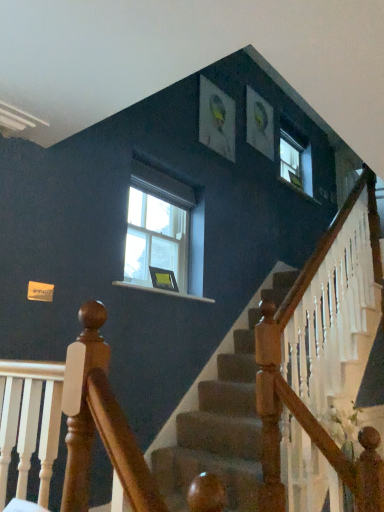
What do you see at coordinates (163, 279) in the screenshot?
I see `matte black picture frame at center` at bounding box center [163, 279].

The width and height of the screenshot is (384, 512). I want to click on matte black picture frame at center, so coord(163,279).

What is the approximate height of clear glass window at center?

31.38 inches.

This screenshot has height=512, width=384. Describe the element at coordinates (163, 232) in the screenshot. I see `clear glass window at center` at that location.

In order to face clear glass window at center, should I rotate leftwards or rightwards?

Rotate left and turn 4.675 degrees.

I want to click on clear glass window at center, so click(163, 232).

From the picture: Measure the distance between clear glass window at center and camera.

clear glass window at center is 9.66 feet away from camera.

You are a GUI agent. You are given a task and a screenshot of the screen. Output one action in this format:
    pyautogui.click(x=<x>, y=<y>)
    Task: Click on the matte black picture frame at center
    Image resolution: width=384 pixels, height=512 pixels.
    Given the screenshot: What is the action you would take?
    pyautogui.click(x=163, y=279)

Does matte black picture frame at center appear on the left side of clear glass window at center?

No.

Relative to clear glass window at center, is matte black picture frame at center in front or behind?

Clearly, matte black picture frame at center is behind clear glass window at center.

Does point (157, 271) lie behind point (164, 252)?

No, it is in front of (164, 252).

From the image's perspective, which one is positioned lower, matte black picture frame at center or clear glass window at center?

matte black picture frame at center appears lower in the image.

From a real-world perspective, is matte black picture frame at center beneath clear glass window at center?

Yes.

Which of these two, matte black picture frame at center or clear glass window at center, is wider?

Wider between the two is matte black picture frame at center.

Is matte black picture frame at center taller than clear glass window at center?

Incorrect, the height of matte black picture frame at center is not larger of that of clear glass window at center.

Considering the relative sizes of matte black picture frame at center and clear glass window at center in the image provided, is matte black picture frame at center bigger than clear glass window at center?

No.

Is matte black picture frame at center outside of clear glass window at center?

matte black picture frame at center lies outside clear glass window at center's area.

Is matte black picture frame at center far from clear glass window at center?

Actually, matte black picture frame at center and clear glass window at center are a little close together.

Does matte black picture frame at center turn towards clear glass window at center?

No, matte black picture frame at center is not aimed at clear glass window at center.

The width and height of the screenshot is (384, 512). There is a matte black picture frame at center. In order to click on window above it (from a real-world perspective) in this screenshot , I will do `click(163, 232)`.

Does clear glass window at center appear on the right side of matte black picture frame at center?

No, clear glass window at center is not to the right of matte black picture frame at center.

Looking at this image, considering the relative positions of clear glass window at center and matte black picture frame at center in the image provided, is clear glass window at center behind matte black picture frame at center?

No, clear glass window at center is in front of matte black picture frame at center.

Considering the positions of point (145, 285) and point (176, 290), is point (145, 285) closer or farther from the camera than point (176, 290)?

Clearly, point (145, 285) is closer to the camera than point (176, 290).

From the image's perspective, is clear glass window at center positioned above or below matte black picture frame at center?

clear glass window at center is situated higher than matte black picture frame at center in the image.

From a real-world perspective, is clear glass window at center positioned under matte black picture frame at center based on gravity?

Actually, clear glass window at center is physically above matte black picture frame at center in the real world.

Is clear glass window at center wider or thinner than matte black picture frame at center?

Considering their sizes, clear glass window at center looks slimmer than matte black picture frame at center.

Which of these two, clear glass window at center or matte black picture frame at center, stands taller?

With more height is clear glass window at center.

Considering the sizes of objects clear glass window at center and matte black picture frame at center in the image provided, who is smaller, clear glass window at center or matte black picture frame at center?

matte black picture frame at center is smaller.

Which is correct: clear glass window at center is inside matte black picture frame at center, or outside of it?

clear glass window at center lies outside matte black picture frame at center.

Would you consider clear glass window at center to be distant from matte black picture frame at center?

They are positioned close to each other.

Is clear glass window at center oriented away from matte black picture frame at center?

No, matte black picture frame at center is not at the back of clear glass window at center.

What's the angular difference between clear glass window at center and matte black picture frame at center's facing directions?

1.59 degrees separate the facing orientations of clear glass window at center and matte black picture frame at center.

At what (x,y) coordinates should I click in order to perform the action: click on picture frame directly beneath the clear glass window at center (from a real-world perspective). Please return your answer as a coordinate pair (x, y). This screenshot has width=384, height=512. Looking at the image, I should click on (163, 279).

The height and width of the screenshot is (512, 384). I want to click on window on the left of the matte black picture frame at center, so click(163, 232).

Where is `window in front of the matte black picture frame at center`? This screenshot has height=512, width=384. window in front of the matte black picture frame at center is located at coordinates (163, 232).